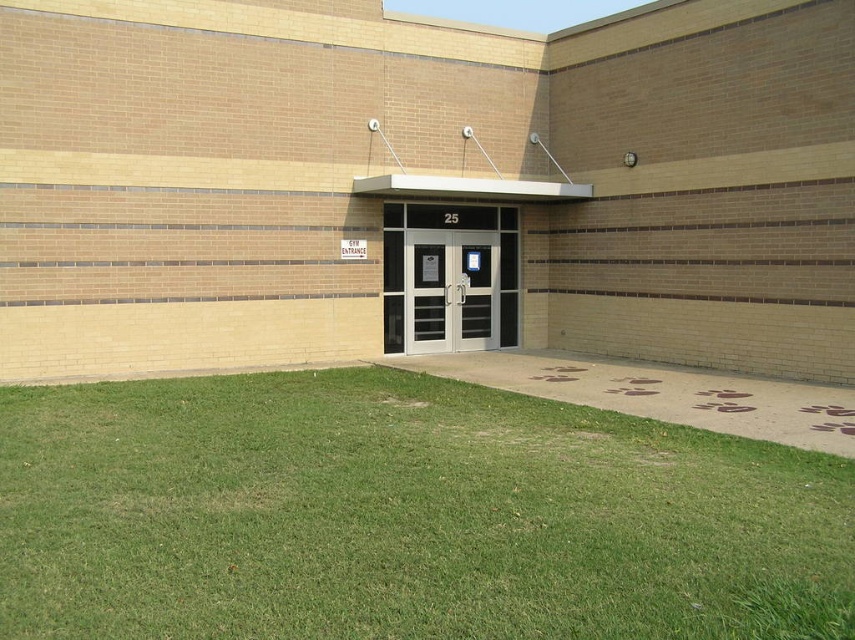
Can you confirm if green grass at lower left is positioned to the right of matte black door at center?

Incorrect, green grass at lower left is not on the right side of matte black door at center.

Who is more forward, (423, 509) or (464, 232)?

Point (423, 509) is more forward.

Is point (851, 518) more distant than point (467, 330)?

No, it is in front of (467, 330).

At what (x,y) coordinates should I click in order to perform the action: click on green grass at lower left. Please return your answer as a coordinate pair (x, y). The image size is (855, 640). Looking at the image, I should click on (404, 516).

Is green grass at lower left wider than white glass doors at center?

Correct, the width of green grass at lower left exceeds that of white glass doors at center.

Which is more to the left, green grass at lower left or white glass doors at center?

green grass at lower left

You are a GUI agent. You are given a task and a screenshot of the screen. Output one action in this format:
    pyautogui.click(x=<x>, y=<y>)
    Task: Click on the green grass at lower left
    This screenshot has width=855, height=640.
    Given the screenshot: What is the action you would take?
    pyautogui.click(x=404, y=516)

Can you confirm if green grass at lower left is bigger than white glass door at center?

Correct, green grass at lower left is larger in size than white glass door at center.

Can you confirm if green grass at lower left is positioned to the right of white glass door at center?

Incorrect, green grass at lower left is not on the right side of white glass door at center.

Image resolution: width=855 pixels, height=640 pixels. What are the coordinates of `green grass at lower left` in the screenshot? It's located at (404, 516).

The image size is (855, 640). Find the location of `green grass at lower left`. green grass at lower left is located at coordinates (404, 516).